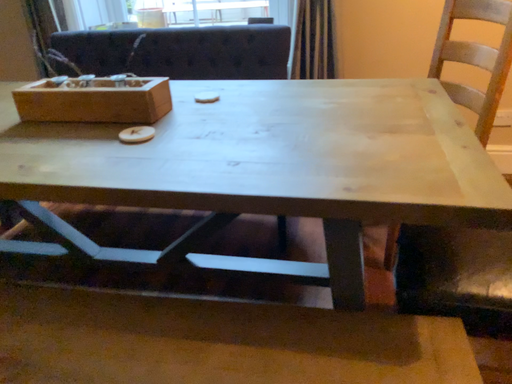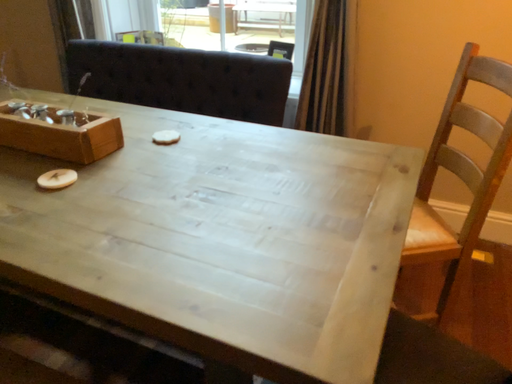
Question: Which way did the camera rotate in the video?

Choices:
 (A) rotated left
 (B) rotated right

Answer: (A)